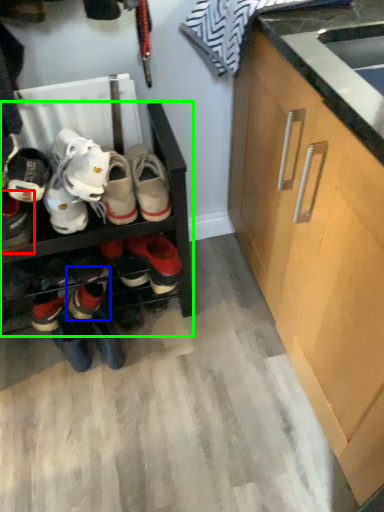
Question: Considering the real-world distances, which object is closest to footwear (highlighted by a red box)? footwear (highlighted by a blue box) or shelf (highlighted by a green box).

Choices:
 (A) footwear
 (B) shelf

Answer: (B)